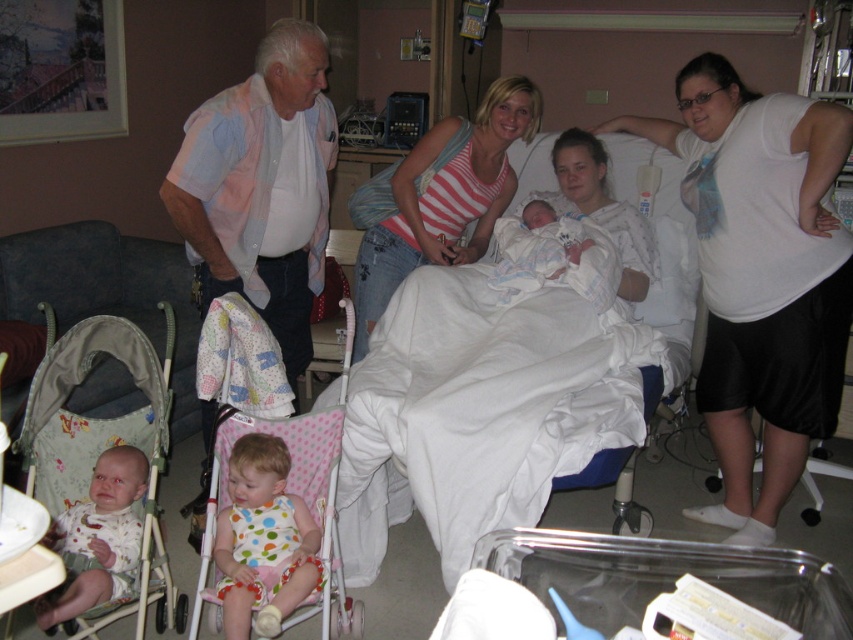
Question: Can you confirm if white fabric hospital bed at center is positioned to the left of matte white blanket at center?

Choices:
 (A) no
 (B) yes

Answer: (A)

Question: Which point is closer to the camera?

Choices:
 (A) (229, 272)
 (B) (793, 461)
 (C) (497, 131)

Answer: (A)

Question: Which object is closer to the camera taking this photo?

Choices:
 (A) matte white blanket at center
 (B) polka dot fabric baby at center

Answer: (B)

Question: Among these points, which one is farthest from the camera?

Choices:
 (A) (236, 225)
 (B) (242, 500)

Answer: (A)

Question: Does white matte shirt at upper right have a greater width compared to white polka dot dress at lower left?

Choices:
 (A) yes
 (B) no

Answer: (A)

Question: Can you confirm if white matte shirt at upper right is positioned below striped tank top at center?

Choices:
 (A) no
 (B) yes

Answer: (B)